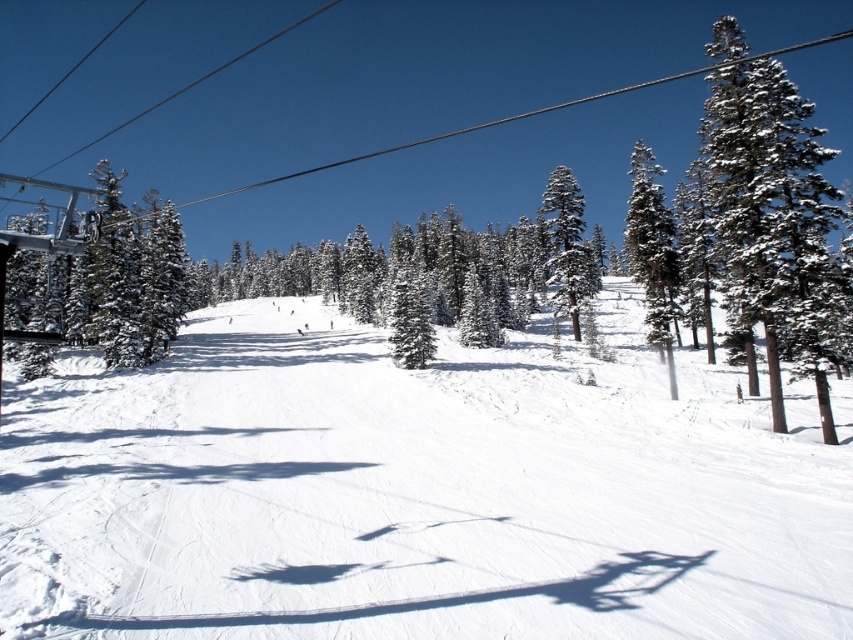
What do you see at coordinates (770, 204) in the screenshot? I see `snow-covered pine trees at upper right` at bounding box center [770, 204].

Is snow-covered pine trees at upper right positioned in front of snow-covered evergreen tree at center-right?

Yes, snow-covered pine trees at upper right is in front of snow-covered evergreen tree at center-right.

Which is in front, point (746, 48) or point (544, 195)?

Point (746, 48)

At what (x,y) coordinates should I click in order to perform the action: click on snow-covered pine trees at upper right. Please return your answer as a coordinate pair (x, y). Looking at the image, I should click on (770, 204).

Can you confirm if white snow ski slope at center is shorter than snow-covered pine trees at upper right?

Yes.

Which of these two, white snow ski slope at center or snow-covered pine trees at upper right, stands shorter?

white snow ski slope at center is shorter.

You are a GUI agent. You are given a task and a screenshot of the screen. Output one action in this format:
    pyautogui.click(x=<x>, y=<y>)
    Task: Click on the white snow ski slope at center
    
    Given the screenshot: What is the action you would take?
    pyautogui.click(x=413, y=493)

Does white snow ski slope at center appear on the right side of snow-covered evergreen tree at center-right?

In fact, white snow ski slope at center is to the left of snow-covered evergreen tree at center-right.

Does white snow ski slope at center appear under snow-covered evergreen tree at center-right?

Indeed, white snow ski slope at center is positioned under snow-covered evergreen tree at center-right.

The height and width of the screenshot is (640, 853). I want to click on white snow ski slope at center, so click(x=413, y=493).

Image resolution: width=853 pixels, height=640 pixels. In order to click on white snow ski slope at center in this screenshot , I will do `click(413, 493)`.